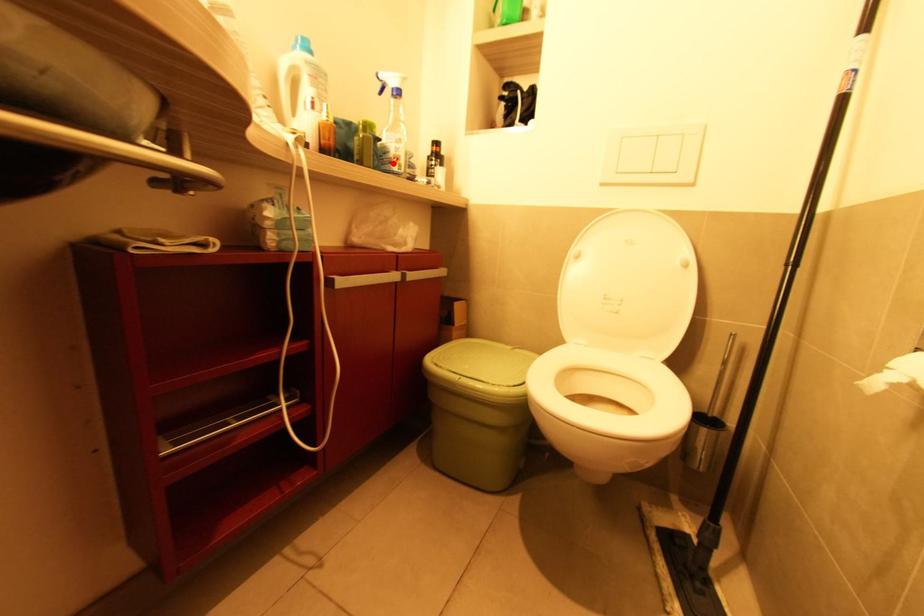
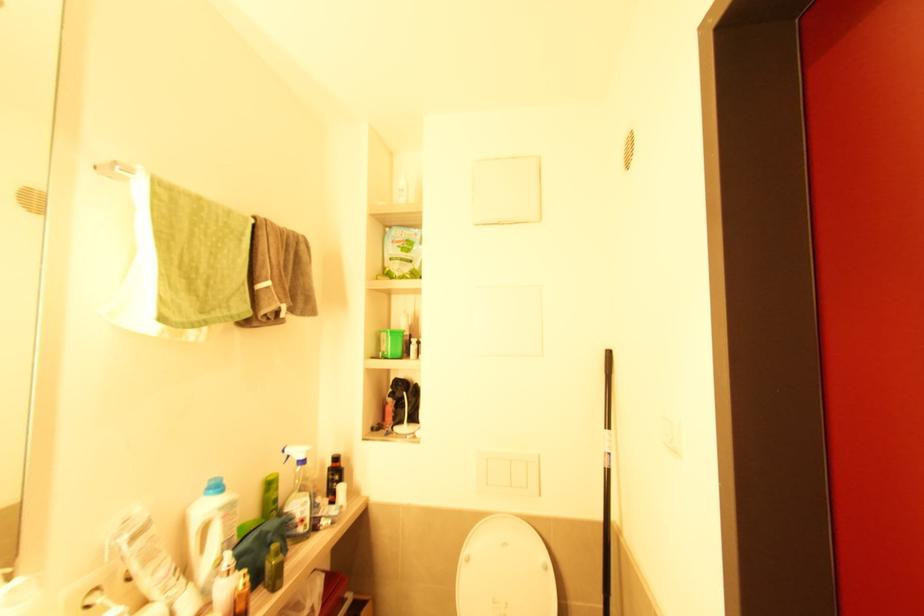
Locate, in the second image, the point that corresponds to the highlighted location in the first image.

(298, 527)